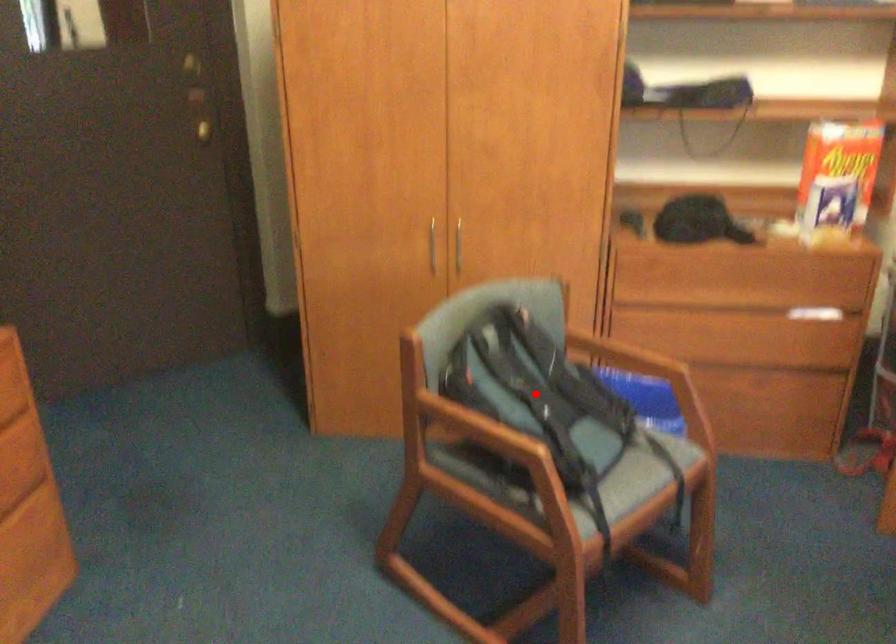
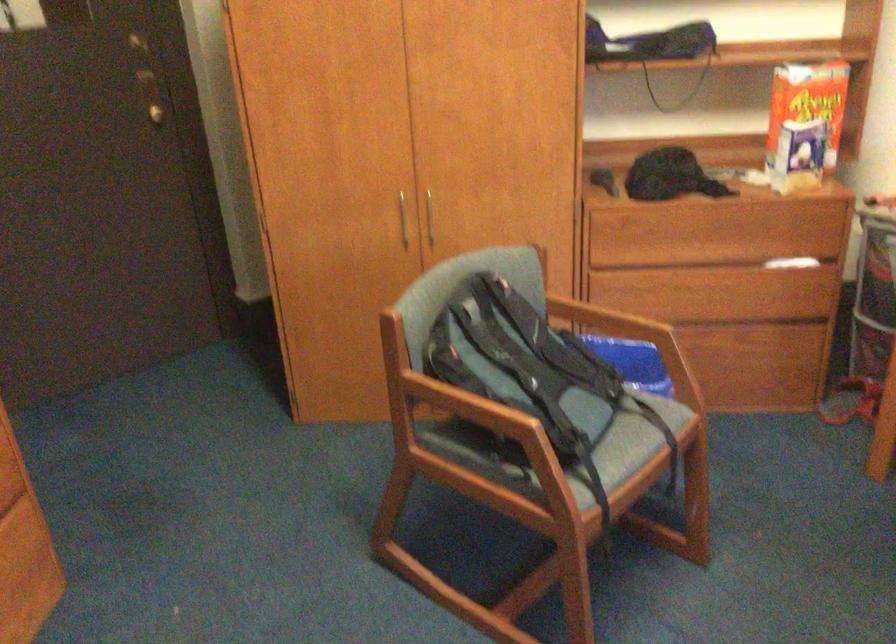
The point at the highlighted location is marked in the first image. Where is the corresponding point in the second image?

(522, 364)